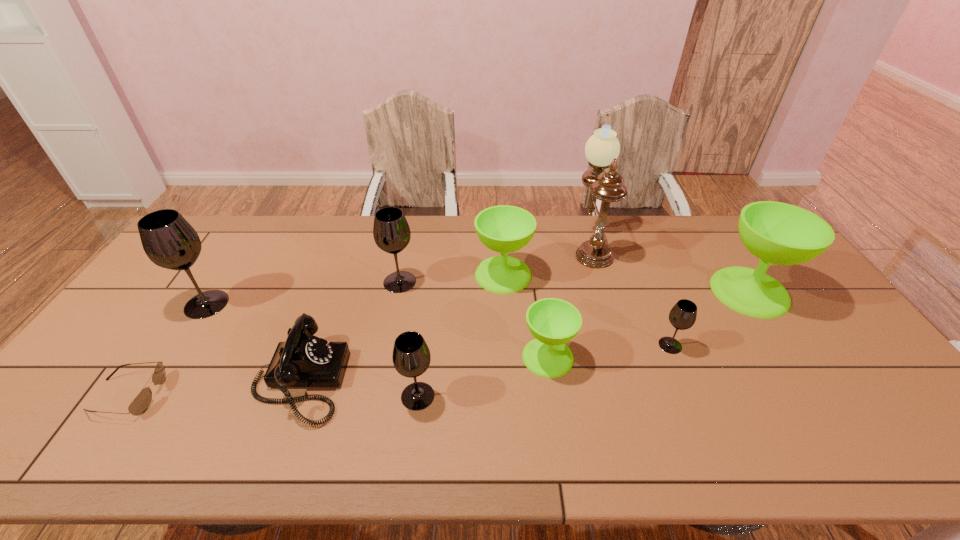
In order to click on the third object from right to left in this screenshot , I will do `click(602, 149)`.

Find the location of a particular element. The image size is (960, 540). the tallest object is located at coordinates (602, 149).

At what (x,y) coordinates should I click in order to perform the action: click on the leftmost wineglass. Please return your answer as a coordinate pair (x, y). The height and width of the screenshot is (540, 960). Looking at the image, I should click on (169, 241).

The height and width of the screenshot is (540, 960). Find the location of `the tallest wineglass`. the tallest wineglass is located at coordinates (169, 241).

You are a GUI agent. You are given a task and a screenshot of the screen. Output one action in this format:
    pyautogui.click(x=<x>, y=<y>)
    Task: Click on the second biggest gray wineglass
    The width and height of the screenshot is (960, 540).
    Given the screenshot: What is the action you would take?
    pyautogui.click(x=391, y=231)

I want to click on the third gray wineglass from right to left, so click(x=391, y=231).

Image resolution: width=960 pixels, height=540 pixels. I want to click on the biggest green wineglass, so click(x=778, y=233).

This screenshot has width=960, height=540. What are the coordinates of `the rightmost object` in the screenshot? It's located at point(778,233).

At what (x,y) coordinates should I click in order to perform the action: click on the second biggest green wineglass. Please return your answer as a coordinate pair (x, y). Looking at the image, I should click on [504, 229].

What are the coordinates of `the nearest gray wineglass` in the screenshot? It's located at (411, 357).